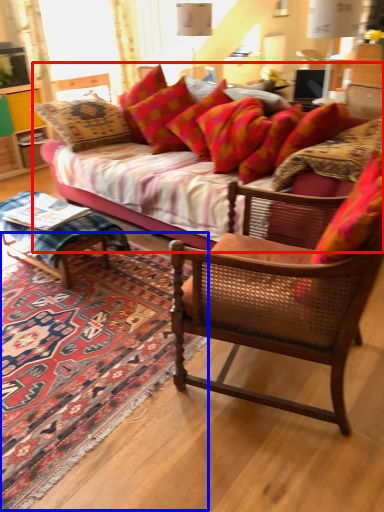
Question: Which of the following is the closest to the observer, studio couch (highlighted by a red box) or mat (highlighted by a blue box)?

Choices:
 (A) studio couch
 (B) mat

Answer: (B)